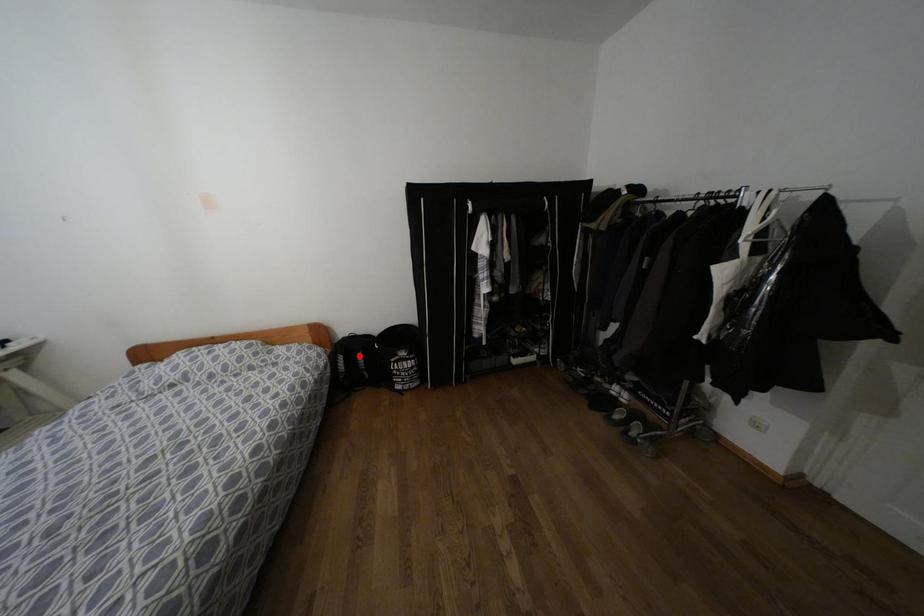
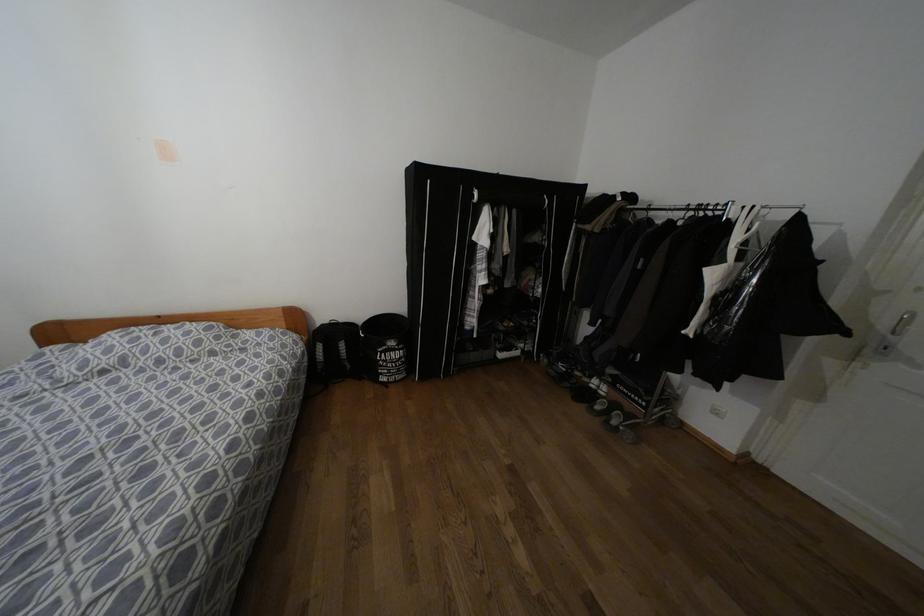
The point at the highlighted location is marked in the first image. Where is the corresponding point in the second image?

(342, 345)